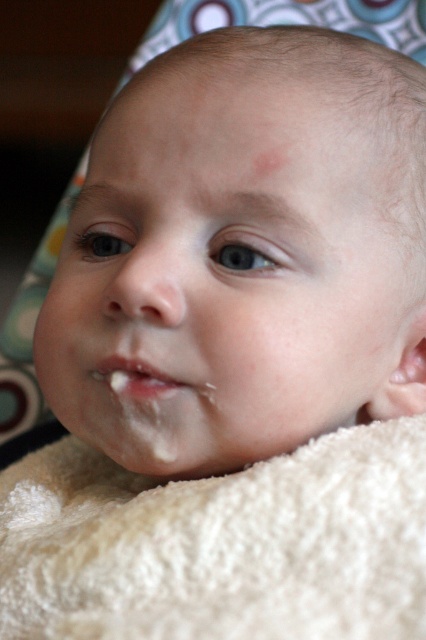
Who is more forward, (14, 488) or (129, 368)?

Point (129, 368) is in front.

Is white fluffy blanket at lower center above white matte lip at center?

Incorrect, white fluffy blanket at lower center is not positioned above white matte lip at center.

Between point (317, 595) and point (193, 387), which one is positioned in front?

Point (317, 595)

The width and height of the screenshot is (426, 640). I want to click on white fluffy blanket at lower center, so click(x=219, y=545).

Between smooth skin baby face at center and white matte lip at center, which one is positioned higher?

smooth skin baby face at center is higher up.

Is point (408, 316) less distant than point (164, 394)?

No.

The width and height of the screenshot is (426, 640). Describe the element at coordinates (232, 276) in the screenshot. I see `smooth skin baby face at center` at that location.

This screenshot has width=426, height=640. I want to click on smooth skin baby face at center, so click(232, 276).

Describe the element at coordinates (232, 276) in the screenshot. I see `smooth skin baby face at center` at that location.

Which of these two, smooth skin baby face at center or white fluffy blanket at lower center, stands shorter?

white fluffy blanket at lower center is shorter.

Find the location of a particular element. Image resolution: width=426 pixels, height=640 pixels. smooth skin baby face at center is located at coordinates (232, 276).